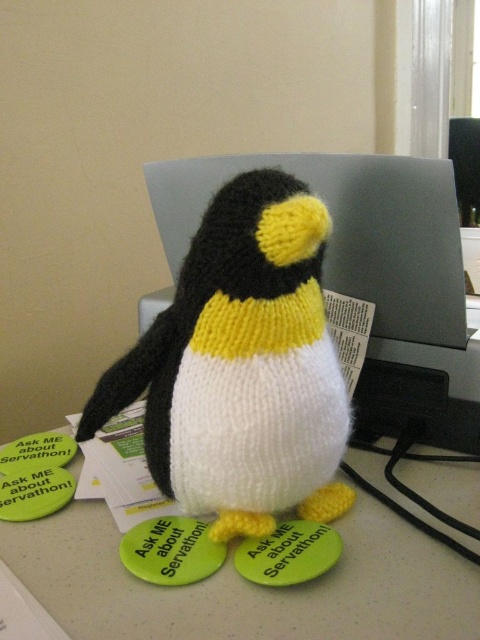
You are a delivery robot with a height of 3 feet. You need to place a package on the desk where the knitted black and white penguin at center and the matte gray computer at center are located. Can you safely place the package between them without hitting your head?

The distance between the knitted black and white penguin at center and the matte gray computer at center is 5.99 inches. Since the robot is 3 feet tall, which is 36 inches, and the vertical space between them is sufficient, the robot can safely place the package between them without hitting its head.

You are a user trying to place a new sticker on the desk. The sticker is 20 inches long. You see the point at (475,515). Can you fit the sticker between the penguin and the point without overlapping?

The distance between the penguin and the point at (475,515) is 19.52 inches. Since the sticker is 20 inches long, it would be 0.48 inches too long to fit without overlapping.